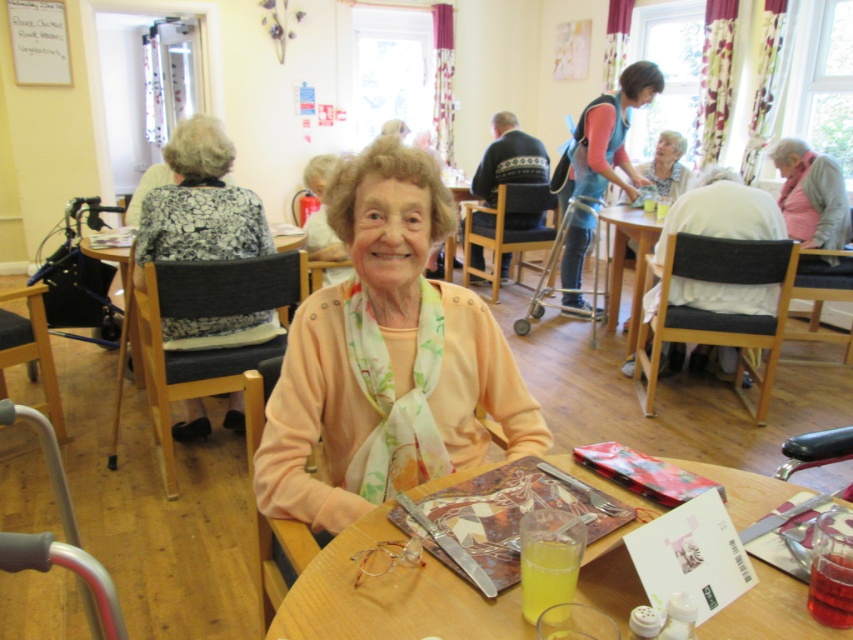
Question: Estimate the real-world distances between objects in this image. Which object is farther from the translucent yellow liquid at table center?

Choices:
 (A) translucent plastic cup at table center
 (B) black textured blouse at upper left
 (C) translucent plastic table at center
 (D) white fabric chair at right

Answer: (D)

Question: Observing the image, what is the correct spatial positioning of peach soft fabric at center in reference to blue fabric apron at upper right?

Choices:
 (A) left
 (B) right

Answer: (A)

Question: Does peach soft fabric at center appear under translucent yellow liquid at table center?

Choices:
 (A) no
 (B) yes

Answer: (A)

Question: Which point is farther to the camera?

Choices:
 (A) peach soft fabric at center
 (B) white fabric chair at right

Answer: (B)

Question: Is black textured blouse at upper left closer to camera compared to translucent plastic cup at table center?

Choices:
 (A) yes
 (B) no

Answer: (B)

Question: Among these objects, which one is nearest to the camera?

Choices:
 (A) peach soft fabric at center
 (B) black textured blouse at upper left
 (C) translucent plastic cup at table center

Answer: (C)